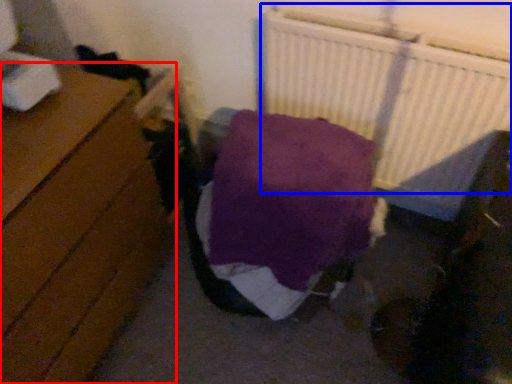
Question: Among these objects, which one is nearest to the camera, furniture (highlighted by a red box) or radiator (highlighted by a blue box)?

Choices:
 (A) furniture
 (B) radiator

Answer: (A)